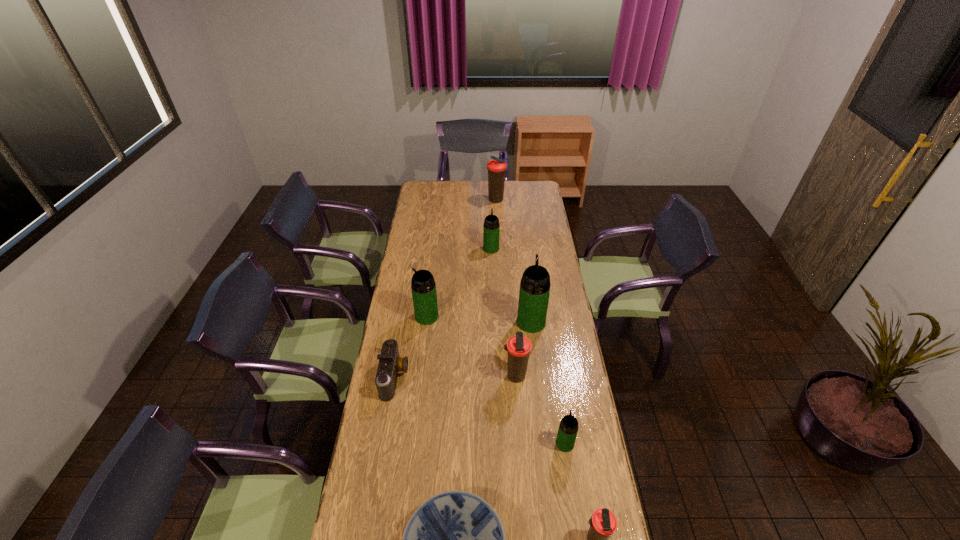
Locate an element on the screen. This screenshot has height=540, width=960. free region at the left edge of the desktop is located at coordinates (417, 210).

This screenshot has height=540, width=960. Find the location of `free point at the right edge`. free point at the right edge is located at coordinates (559, 305).

In the image, there is a desktop. Identify the location of vacant space at the far right corner. The width and height of the screenshot is (960, 540). (539, 185).

Find the location of `vacant space that is in between the biggest brown thermos bottle and the leftmost thermos bottle`. vacant space that is in between the biggest brown thermos bottle and the leftmost thermos bottle is located at coordinates (462, 258).

You are a GUI agent. You are given a task and a screenshot of the screen. Output one action in this format:
    pyautogui.click(x=<x>, y=<y>)
    Task: Click on the vacant point located between the second biggest brown thermos bottle and the smallest green thermos bottle
    The image size is (960, 540).
    Given the screenshot: What is the action you would take?
    pyautogui.click(x=540, y=410)

The height and width of the screenshot is (540, 960). Find the location of `object identified as the second closest to the smallest green thermos bottle`. object identified as the second closest to the smallest green thermos bottle is located at coordinates (603, 523).

I want to click on object that is the sixth closest to the farthest brown thermos bottle, so tap(568, 428).

Identify which thermos bottle is the second closest to the farthest brown thermos bottle. Please provide its 2D coordinates. Your answer should be formatted as a tuple, i.e. [(x, y)], where the tuple contains the x and y coordinates of a point satisfying the conditions above.

[(534, 292)]

In order to click on the third closest thermos bottle relative to the second biggest green thermos bottle in this screenshot , I will do `click(491, 228)`.

Where is `green thermos bottle that is the fourth closest to the nearest thermos bottle`? Image resolution: width=960 pixels, height=540 pixels. green thermos bottle that is the fourth closest to the nearest thermos bottle is located at coordinates (491, 228).